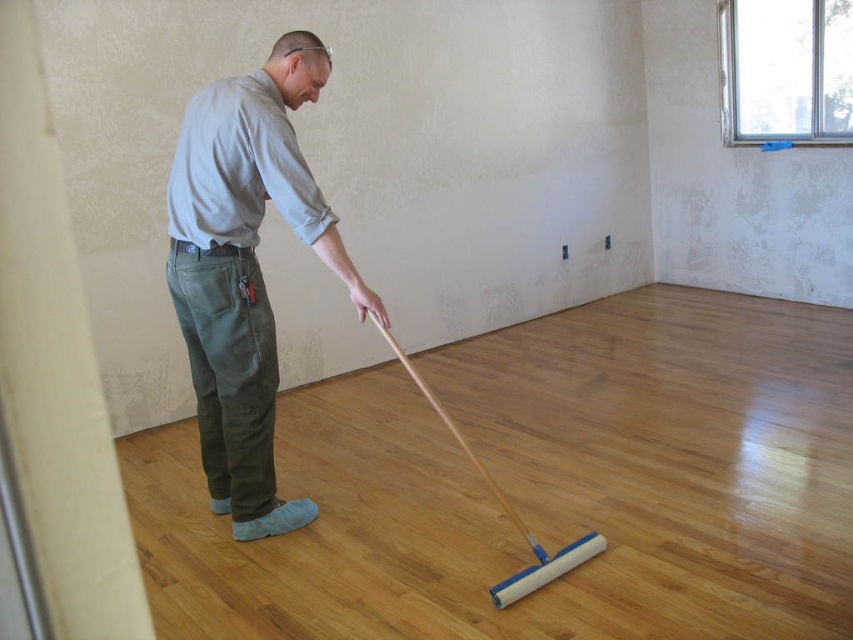
Consider the image. Is light gray cotton shirt at center to the left of white foam swab at center from the viewer's perspective?

Indeed, light gray cotton shirt at center is positioned on the left side of white foam swab at center.

Can you confirm if light gray cotton shirt at center is thinner than white foam swab at center?

Yes.

Measure the distance between light gray cotton shirt at center and camera.

light gray cotton shirt at center and camera are 7.70 feet apart.

This screenshot has height=640, width=853. I want to click on light gray cotton shirt at center, so click(245, 269).